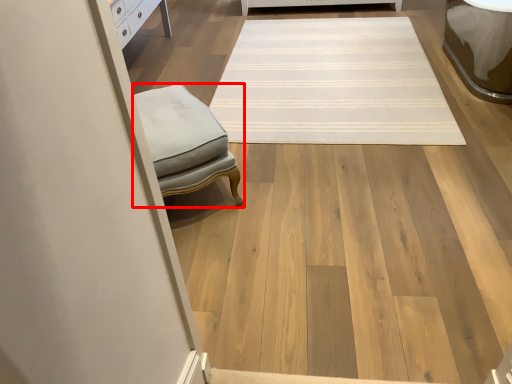
Question: From the image's perspective, what is the correct spatial relationship of furniture (annotated by the red box) in relation to mat?

Choices:
 (A) above
 (B) below

Answer: (B)